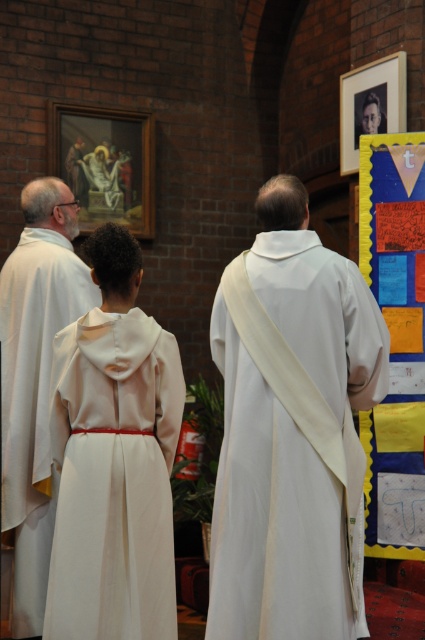
Does white clothed man at center have a lesser width compared to white matte robe at left?

Incorrect, white clothed man at center's width is not less than white matte robe at left's.

Can you confirm if white clothed man at center is positioned above white matte robe at left?

Yes, white clothed man at center is above white matte robe at left.

Image resolution: width=425 pixels, height=640 pixels. Find the location of `white clothed man at center`. white clothed man at center is located at coordinates (291, 429).

Does white clothed man at center appear on the right side of white matte dress at center?

Yes, white clothed man at center is to the right of white matte dress at center.

Find the location of a particular element. The width and height of the screenshot is (425, 640). white clothed man at center is located at coordinates (291, 429).

Find the location of `white clothed man at center`. white clothed man at center is located at coordinates (291, 429).

Describe the element at coordinates (113, 477) in the screenshot. I see `white matte dress at center` at that location.

Can you confirm if white matte dress at center is positioned above white matte robe at left?

No.

The height and width of the screenshot is (640, 425). What are the coordinates of `white matte dress at center` in the screenshot? It's located at [x=113, y=477].